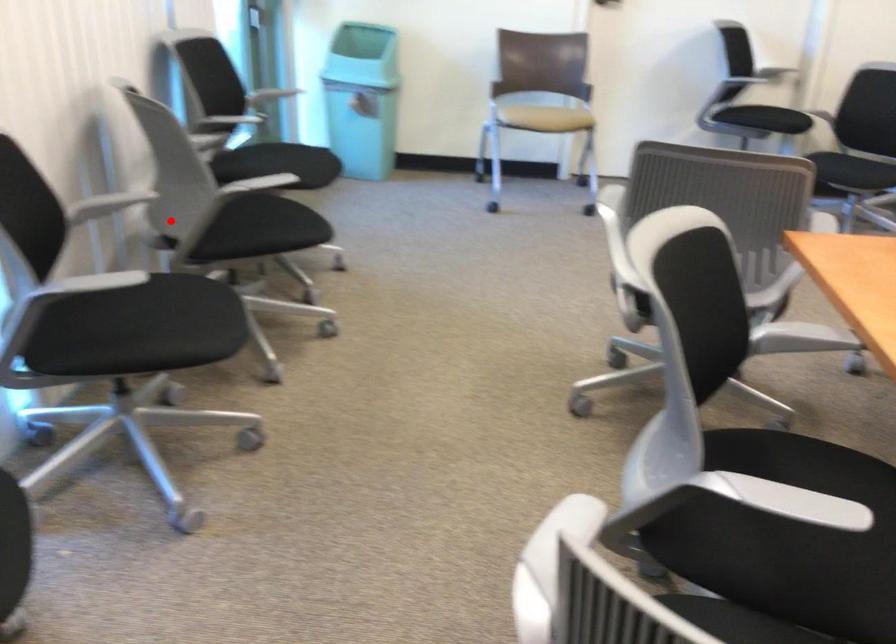
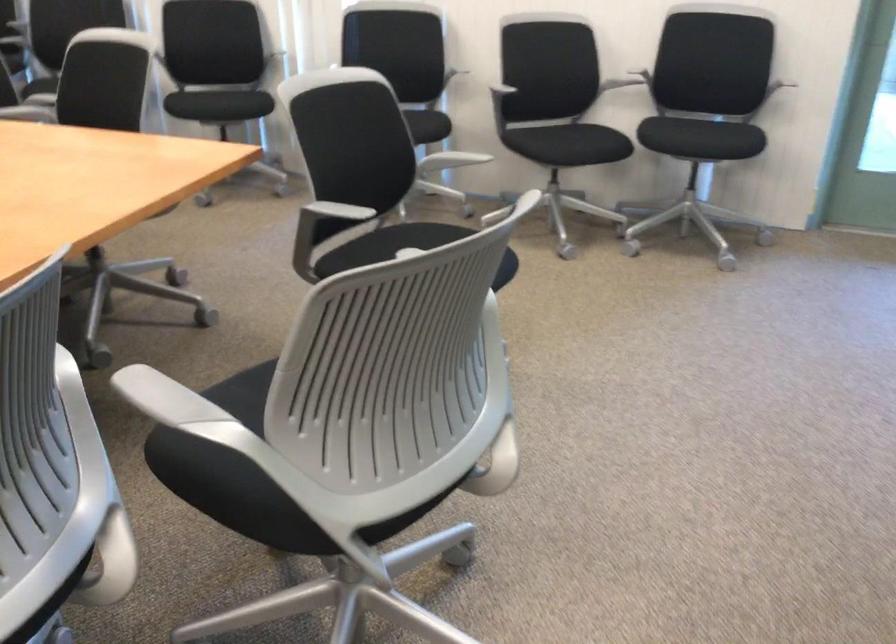
Question: A red point is marked in image1. In image2, is the corresponding 3D point closer to the camera or farther? Reply with the corresponding letter.

Choices:
 (A) The corresponding 3D point is closer.
 (B) The corresponding 3D point is farther.

Answer: (B)